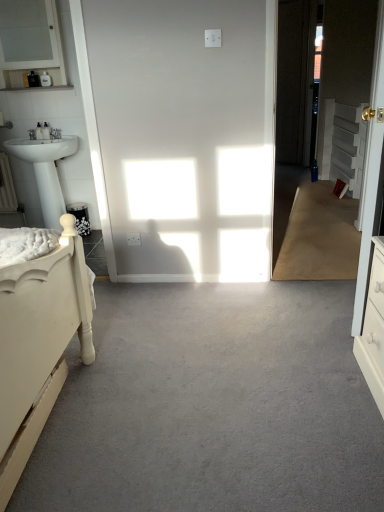
Question: Considering the relative sizes of gray carpet at center and matte white cabinet at upper left in the image provided, is gray carpet at center taller than matte white cabinet at upper left?

Choices:
 (A) no
 (B) yes

Answer: (A)

Question: Is gray carpet at center oriented towards matte white cabinet at upper left?

Choices:
 (A) yes
 (B) no

Answer: (B)

Question: Is gray carpet at center further to the viewer compared to matte white cabinet at upper left?

Choices:
 (A) no
 (B) yes

Answer: (A)

Question: Is gray carpet at center positioned in front of matte white cabinet at upper left?

Choices:
 (A) yes
 (B) no

Answer: (A)

Question: Considering the relative sizes of gray carpet at center and matte white cabinet at upper left in the image provided, is gray carpet at center wider than matte white cabinet at upper left?

Choices:
 (A) yes
 (B) no

Answer: (A)

Question: Is gray carpet at center at the left side of matte white cabinet at upper left?

Choices:
 (A) yes
 (B) no

Answer: (B)

Question: Can you confirm if white glossy pedestal sink at left is positioned to the left of white glossy door at right?

Choices:
 (A) no
 (B) yes

Answer: (B)

Question: Does white glossy pedestal sink at left come in front of white glossy door at right?

Choices:
 (A) yes
 (B) no

Answer: (B)

Question: Considering the relative positions of white glossy pedestal sink at left and white glossy door at right in the image provided, is white glossy pedestal sink at left behind white glossy door at right?

Choices:
 (A) yes
 (B) no

Answer: (A)

Question: From the image's perspective, is white glossy pedestal sink at left beneath white glossy door at right?

Choices:
 (A) yes
 (B) no

Answer: (A)

Question: Can you confirm if white glossy pedestal sink at left is wider than white glossy door at right?

Choices:
 (A) no
 (B) yes

Answer: (B)

Question: From a real-world perspective, is white glossy pedestal sink at left positioned under white glossy door at right based on gravity?

Choices:
 (A) yes
 (B) no

Answer: (A)

Question: Does matte white cabinet at upper left appear on the right side of white glossy door at right?

Choices:
 (A) no
 (B) yes

Answer: (A)